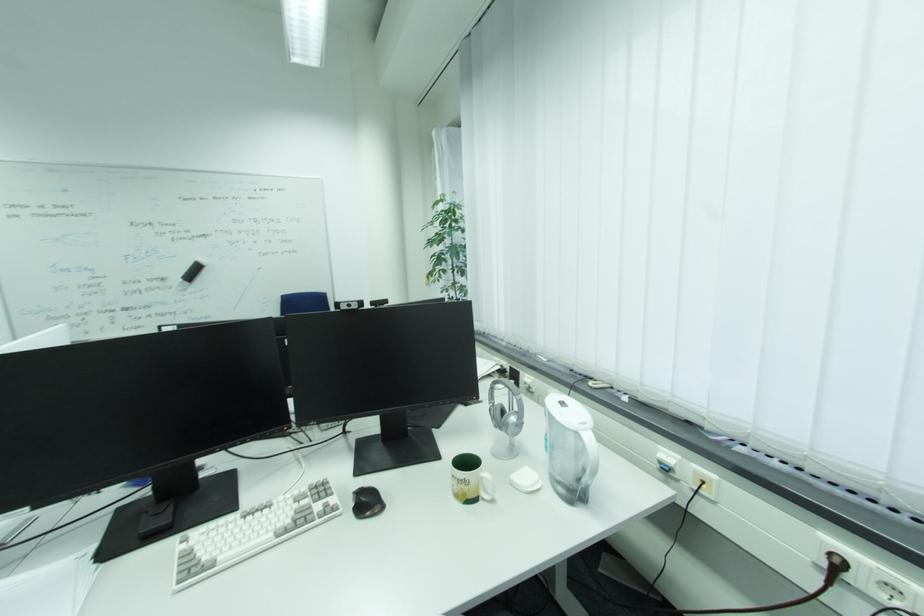
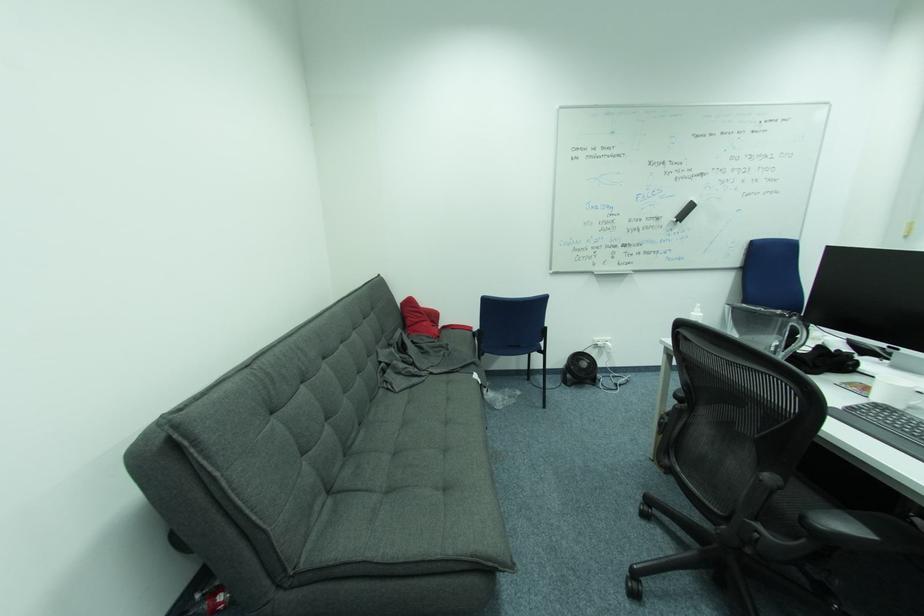
Question: The images are taken continuously from a first-person perspective. In which direction are you moving?

Choices:
 (A) Left
 (B) Right
 (C) Forward
 (D) Backward

Answer: (A)